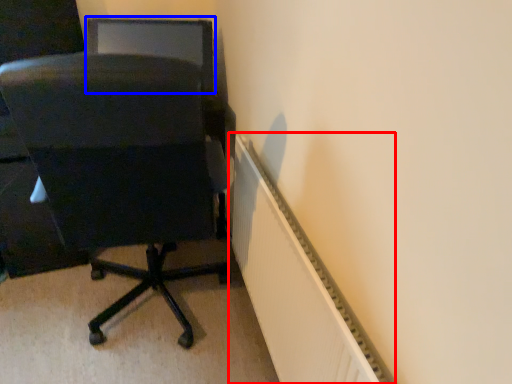
Question: Which object appears farthest to the camera in this image, radiator (highlighted by a red box) or computer monitor (highlighted by a blue box)?

Choices:
 (A) radiator
 (B) computer monitor

Answer: (B)